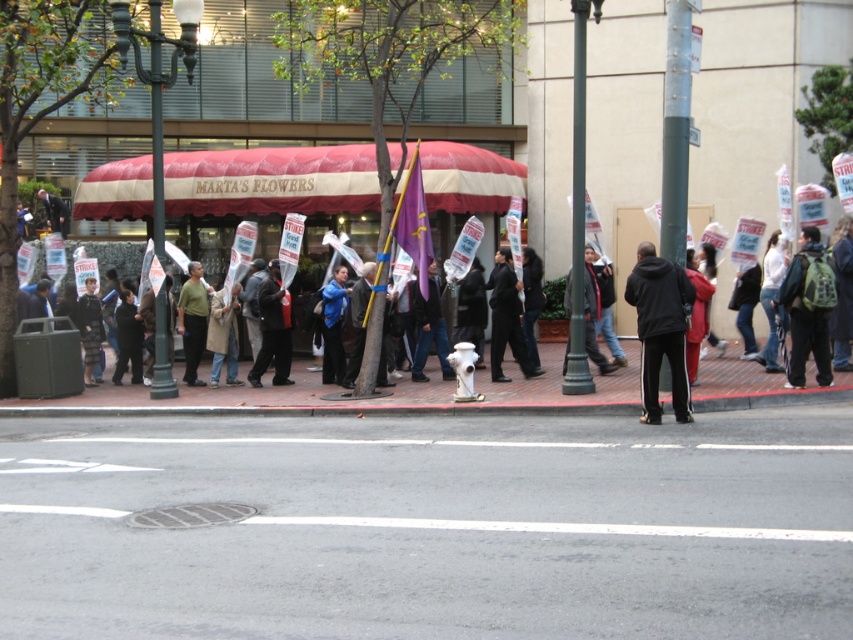
You are a pedestrian trying to cross the street. You see the gray asphalt at lower center and the green backpack at right. Which object is closer to the ground?

The gray asphalt at lower center is closer to the ground because it is shorter than the green backpack at right.